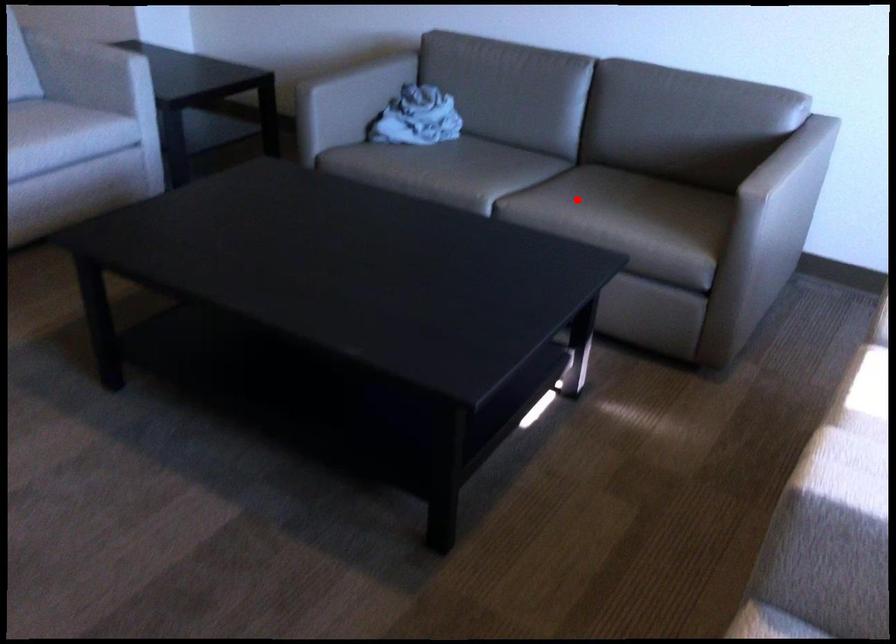
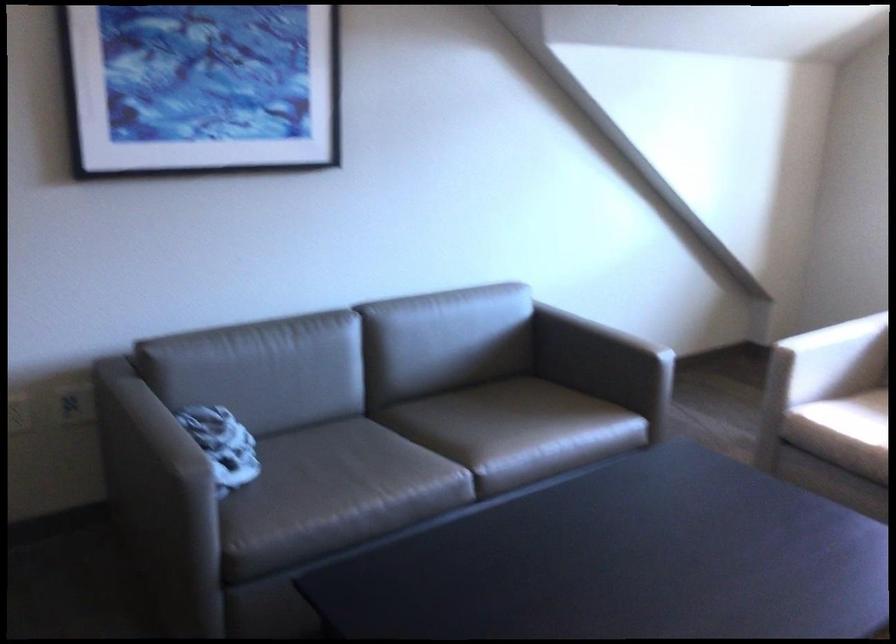
The point at the highlighted location is marked in the first image. Where is the corresponding point in the second image?

(497, 430)